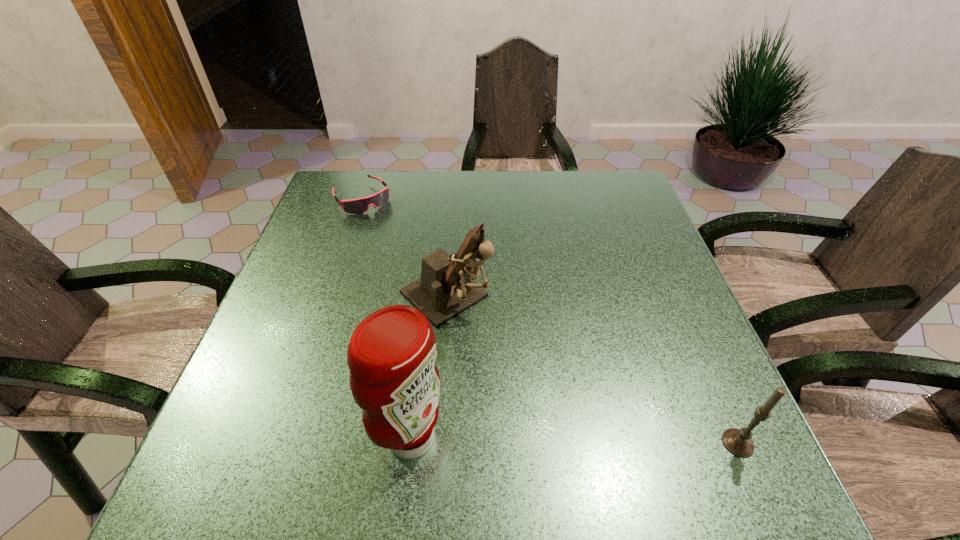
What are the coordinates of `object positioned at the near right corner` in the screenshot? It's located at coord(738,442).

You are a GUI agent. You are given a task and a screenshot of the screen. Output one action in this format:
    pyautogui.click(x=<x>, y=<y>)
    Task: Click on the vacant point at the far edge
    This screenshot has width=960, height=540.
    Given the screenshot: What is the action you would take?
    pyautogui.click(x=536, y=187)

Where is `free point at the left edge`? Image resolution: width=960 pixels, height=540 pixels. free point at the left edge is located at coordinates (315, 258).

Locate an element on the screen. free spot at the right edge of the desktop is located at coordinates (640, 325).

At what (x,y) coordinates should I click in order to perform the action: click on free space at the far left corner of the desktop. Please return your answer as a coordinate pair (x, y). The width and height of the screenshot is (960, 540). Looking at the image, I should click on (383, 171).

You are a GUI agent. You are given a task and a screenshot of the screen. Output one action in this format:
    pyautogui.click(x=<x>, y=<y>)
    Task: Click on the free space at the near left corner of the desktop
    The image size is (960, 540).
    Given the screenshot: What is the action you would take?
    pyautogui.click(x=240, y=401)

At what (x,y) coordinates should I click in order to perform the action: click on vacant region at the far right corner of the desktop. Please return your answer as a coordinate pair (x, y). This screenshot has height=540, width=960. Looking at the image, I should click on (593, 199).

In the image, there is a desktop. Identify the location of vacant area at the near right corner. The width and height of the screenshot is (960, 540). pos(659,396).

Where is `free space between the candle and the condiment`? This screenshot has width=960, height=540. free space between the candle and the condiment is located at coordinates (574, 440).

Find the location of a particular element. The image size is (960, 540). vacant space in between the figurine and the rightmost object is located at coordinates (591, 370).